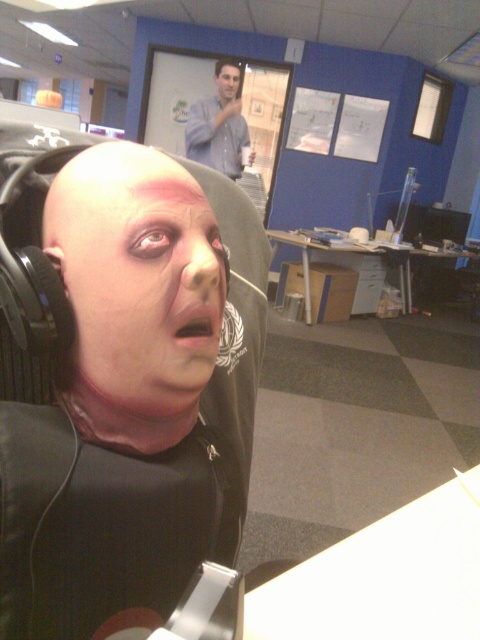
You are designing a new office layout and need to ensure that the matte black mask at center and the matte black head at upper center can be clearly seen from the entrance. Given their sizes, which object might require a more strategic placement to avoid being obscured by others?

The matte black mask at center has a larger width than the matte black head at upper center, so it might require more strategic placement to avoid being obscured due to its larger size.

You are an office security guard who just entered the room. You notice the matte black mask at center and the matte black head at upper center. Which object is located below the other?

The matte black mask at center is positioned under the matte black head at upper center, so the matte black mask at center is below the matte black head at upper center.